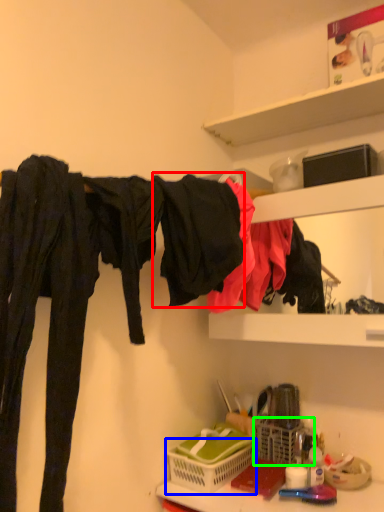
Question: Which is nearer to the clothing (highlighted by a red box)? basket (highlighted by a blue box) or basket (highlighted by a green box).

Choices:
 (A) basket
 (B) basket

Answer: (A)